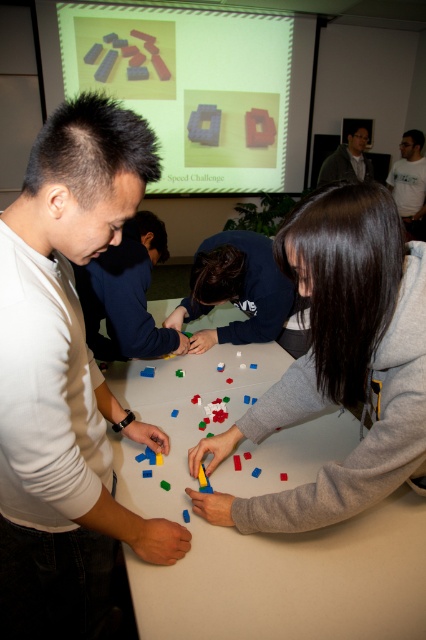
In the scene shown: Can you confirm if white matte table at center is positioned to the left of blue fabric shirt at center?

Indeed, white matte table at center is positioned on the left side of blue fabric shirt at center.

Does white matte table at center lie behind blue fabric shirt at center?

No, it is not.

Is point (169, 634) in front of point (244, 257)?

That is True.

Where is `white matte table at center`? white matte table at center is located at coordinates (258, 532).

Does matte white shirt at left have a greater height compared to matte white shirt at center?

Indeed, matte white shirt at left has a greater height compared to matte white shirt at center.

Which is more to the right, matte white shirt at left or matte white shirt at center?

matte white shirt at left

Does point (60, 621) come closer to viewer compared to point (109, 273)?

Yes, it is.

The image size is (426, 640). Find the location of `matte white shirt at left`. matte white shirt at left is located at coordinates (71, 364).

Which is more to the left, matte white shirt at center or white t-shirt at upper right?

Positioned to the left is matte white shirt at center.

Is point (149, 314) closer to viewer compared to point (420, 141)?

Yes, point (149, 314) is closer to viewer.

Does point (129, 353) come farther from viewer compared to point (414, 148)?

No.

Find the location of a particular element. matte white shirt at center is located at coordinates (126, 294).